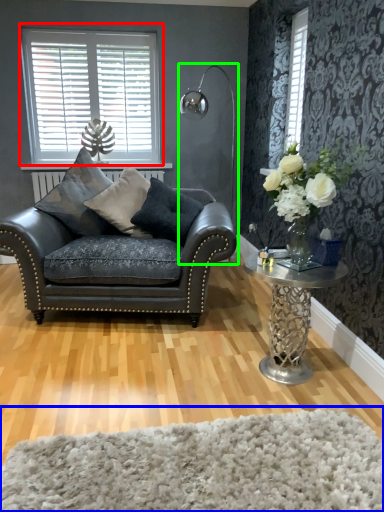
Question: Considering the real-world distances, which object is closest to window (highlighted by a red box)? plain (highlighted by a blue box) or lamp (highlighted by a green box).

Choices:
 (A) plain
 (B) lamp

Answer: (B)